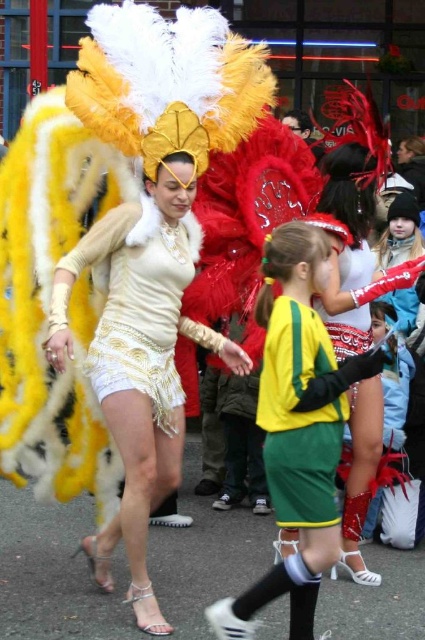
Question: Does yellow-green jersey at center have a larger size compared to shiny gold sequined dress at center?

Choices:
 (A) no
 (B) yes

Answer: (B)

Question: Can you confirm if matte gold dress at center is positioned to the right of green jersey at center?

Choices:
 (A) no
 (B) yes

Answer: (A)

Question: Which point is closer to the camera?

Choices:
 (A) yellow-green jersey at center
 (B) matte gold dress at center

Answer: (A)

Question: Estimate the real-world distances between objects in this image. Which object is closer to the green jersey at center?

Choices:
 (A) shiny gold sequined dress at center
 (B) matte gold dress at center

Answer: (B)

Question: Which object is closer to the camera taking this photo?

Choices:
 (A) yellow-green jersey at center
 (B) matte gold dress at center

Answer: (A)

Question: Is yellow-green jersey at center thinner than green jersey at center?

Choices:
 (A) yes
 (B) no

Answer: (B)